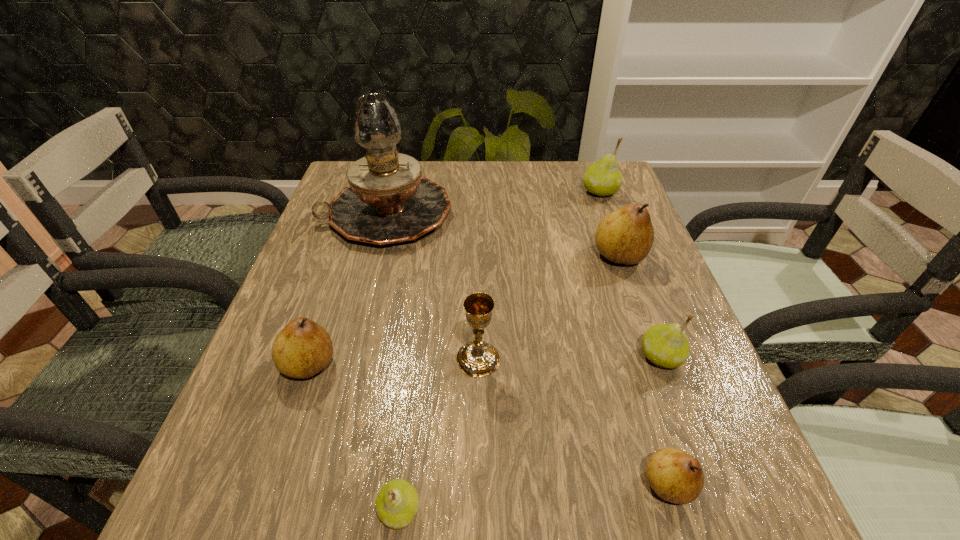
Where is `oil lamp positioned at the far edge`? This screenshot has width=960, height=540. oil lamp positioned at the far edge is located at coordinates (388, 201).

The width and height of the screenshot is (960, 540). I want to click on pear that is at the far edge, so click(603, 178).

Identify the location of oil lamp at the left edge. (388, 201).

This screenshot has width=960, height=540. Find the location of `pear positioned at the left edge`. pear positioned at the left edge is located at coordinates (303, 348).

Locate an element on the screen. Image resolution: width=960 pixels, height=540 pixels. object at the far left corner is located at coordinates (388, 201).

The height and width of the screenshot is (540, 960). Identify the location of object positioned at the far right corner. (603, 178).

This screenshot has height=540, width=960. Find the location of `object situated at the near right corner`. object situated at the near right corner is located at coordinates (676, 476).

The height and width of the screenshot is (540, 960). Find the location of `free space at the far edge of the desktop`. free space at the far edge of the desktop is located at coordinates (527, 175).

The width and height of the screenshot is (960, 540). Identify the location of vacant space at the near edge of the desktop. (448, 530).

Where is `vacant space at the left edge of the desktop`? The height and width of the screenshot is (540, 960). vacant space at the left edge of the desktop is located at coordinates (253, 446).